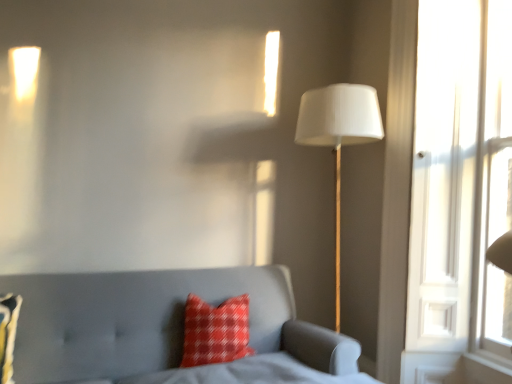
Question: Is white fabric lampshade at right not inside matte gray sofa at lower left?

Choices:
 (A) yes
 (B) no

Answer: (A)

Question: Can you confirm if white fabric lampshade at right is positioned to the right of matte gray sofa at lower left?

Choices:
 (A) yes
 (B) no

Answer: (A)

Question: Is white fabric lampshade at right bigger than matte gray sofa at lower left?

Choices:
 (A) yes
 (B) no

Answer: (B)

Question: Is the position of white fabric lampshade at right more distant than that of matte gray sofa at lower left?

Choices:
 (A) yes
 (B) no

Answer: (A)

Question: From the image's perspective, is white fabric lampshade at right located above matte gray sofa at lower left?

Choices:
 (A) no
 (B) yes

Answer: (B)

Question: Visually, is matte gray sofa at lower left positioned to the left or to the right of white fabric lampshade at right?

Choices:
 (A) right
 (B) left

Answer: (B)

Question: In terms of width, does matte gray sofa at lower left look wider or thinner when compared to white fabric lampshade at right?

Choices:
 (A) thin
 (B) wide

Answer: (B)

Question: From the image's perspective, relative to white fabric lampshade at right, is matte gray sofa at lower left above or below?

Choices:
 (A) above
 (B) below

Answer: (B)

Question: From a real-world perspective, relative to white fabric lampshade at right, is matte gray sofa at lower left vertically above or below?

Choices:
 (A) below
 (B) above

Answer: (A)

Question: Is red plaid pillow at lower left, placed as the 1th pillow when sorted from front to back, bigger or smaller than red plaid pillow at center, acting as the second pillow starting from the left?

Choices:
 (A) big
 (B) small

Answer: (B)

Question: Is red plaid pillow at lower left, acting as the first pillow starting from the left, wider or thinner than red plaid pillow at center, the second pillow from the front?

Choices:
 (A) thin
 (B) wide

Answer: (B)

Question: Is red plaid pillow at lower left, which is counted as the 2th pillow, starting from the back, spatially inside red plaid pillow at center, the second pillow from the front, or outside of it?

Choices:
 (A) inside
 (B) outside

Answer: (B)

Question: From their relative heights in the image, would you say red plaid pillow at lower left, placed as the 1th pillow when sorted from front to back, is taller or shorter than red plaid pillow at center, the 1th pillow when ordered from back to front?

Choices:
 (A) short
 (B) tall

Answer: (B)

Question: From a real-world perspective, is red plaid pillow at center, acting as the second pillow starting from the left, above or below white fabric lampshade at right?

Choices:
 (A) above
 (B) below

Answer: (B)

Question: Is red plaid pillow at center, the 1th pillow when ordered from back to front, situated inside white fabric lampshade at right or outside?

Choices:
 (A) inside
 (B) outside

Answer: (B)